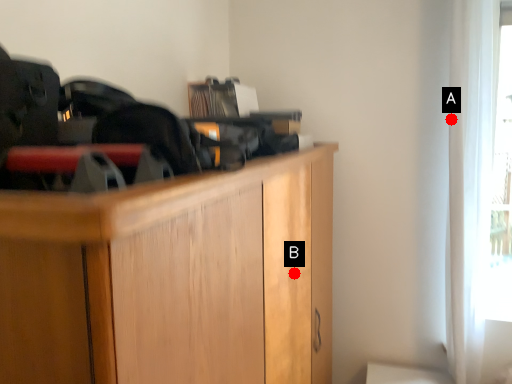
Question: Two points are circled on the image, labeled by A and B beside each circle. Which point is further to the camera?

Choices:
 (A) A is further
 (B) B is further

Answer: (A)